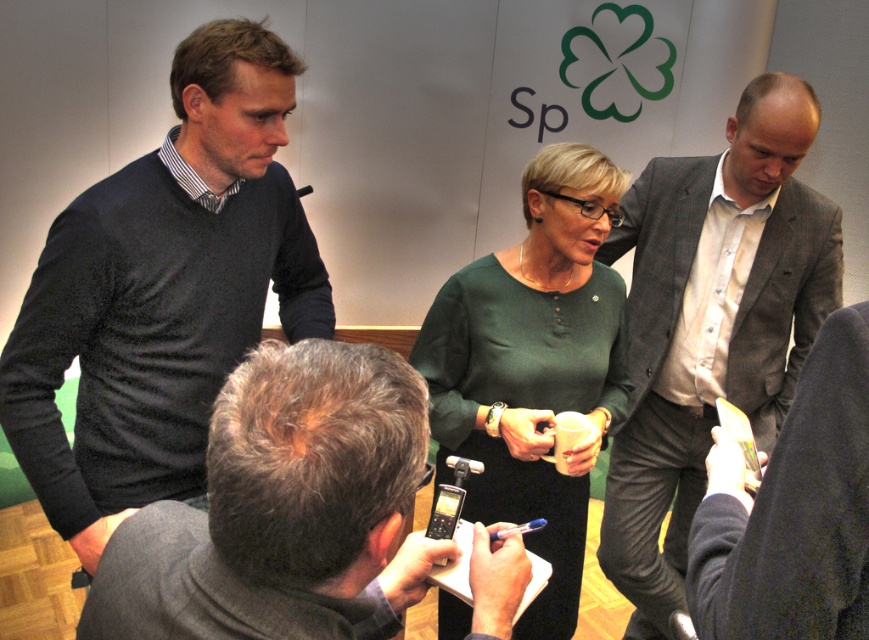
You are standing at the origin point of the coordinate system. The dark gray sweater at left is located at point (x=163, y=292). What is the direction of the dark gray sweater at left relative to your position?

The dark gray sweater at left is located at point (x=163, y=292), which means it is to the northeast of your position.

You are attending a conference and need to locate the person wearing the dark gray sweater at left and the green matte dress at center. From your perspective facing the group, which direction should you look first to see both individuals?

You should first look to the left to see the dark gray sweater at left, then shift your gaze to the center to see the green matte dress at center, as the dark gray sweater at left is positioned to the left of the green matte dress at center.